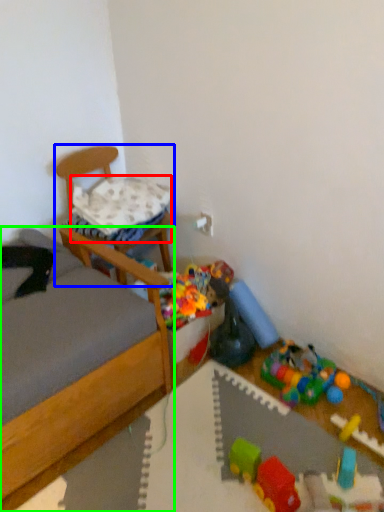
Question: Considering the real-world distances, which object is farthest from pillow (highlighted by a red box)? chair (highlighted by a blue box) or bed (highlighted by a green box)?

Choices:
 (A) chair
 (B) bed

Answer: (B)